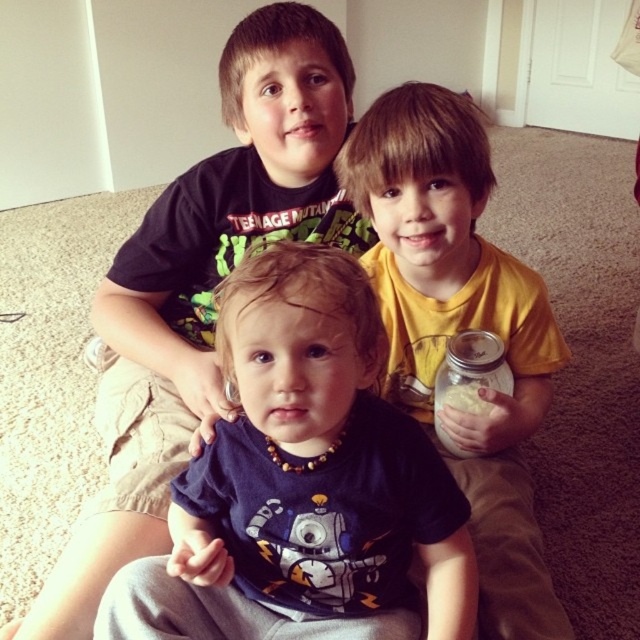
Question: Which of the following is the farthest from the observer?

Choices:
 (A) (468, 109)
 (B) (470, 452)

Answer: (B)

Question: Which of the following is the farthest from the observer?

Choices:
 (A) yellow matte shirt at center
 (B) blue fabric shirt at center
 (C) clear glass jar at center
 (D) robot t-shirt at center

Answer: (C)

Question: Is robot t-shirt at center smaller than yellow matte shirt at center?

Choices:
 (A) yes
 (B) no

Answer: (A)

Question: Is blue fabric shirt at center further to the viewer compared to clear glass jar at center?

Choices:
 (A) yes
 (B) no

Answer: (B)

Question: Which point is closer to the camera?

Choices:
 (A) blue fabric shirt at center
 (B) clear glass jar at center
 (C) yellow matte shirt at center

Answer: (C)

Question: Is robot t-shirt at center wider than yellow matte shirt at center?

Choices:
 (A) yes
 (B) no

Answer: (A)